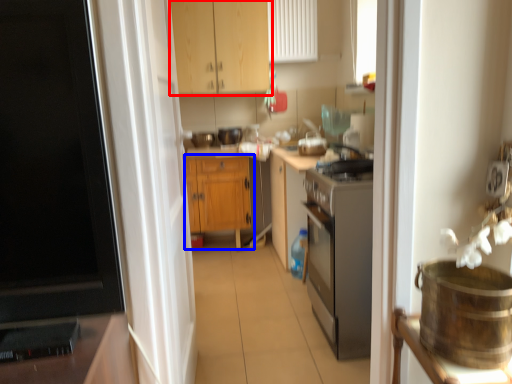
Question: Which point is further to the camera, cabinetry (highlighted by a red box) or cabinetry (highlighted by a blue box)?

Choices:
 (A) cabinetry
 (B) cabinetry

Answer: (B)